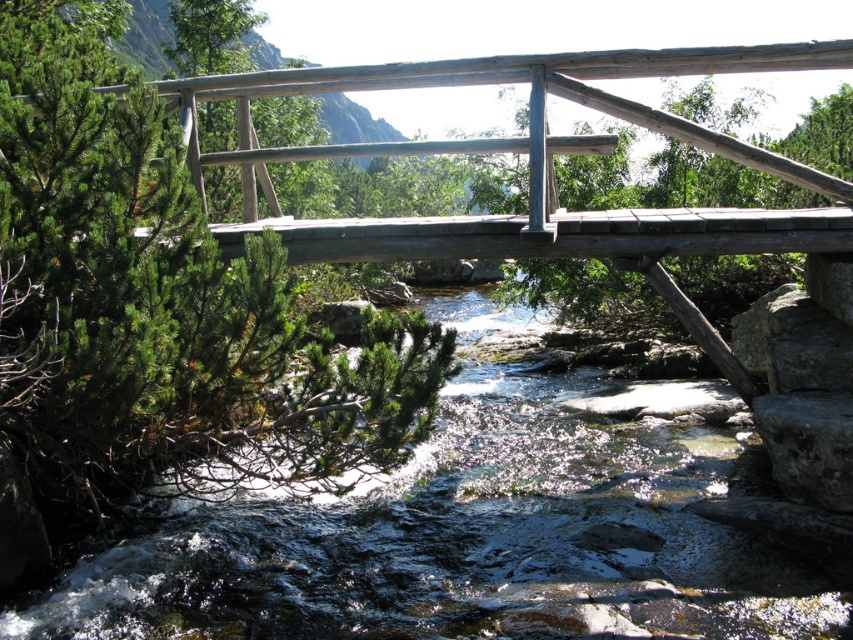
Question: From the image, what is the correct spatial relationship of clear water at center in relation to natural wood bridge at center?

Choices:
 (A) below
 (B) above

Answer: (A)

Question: Which point appears closest to the camera in this image?

Choices:
 (A) (727, 449)
 (B) (825, 193)

Answer: (B)

Question: Does clear water at center have a smaller size compared to natural wood bridge at center?

Choices:
 (A) yes
 (B) no

Answer: (B)

Question: Which of the following is the farthest from the observer?

Choices:
 (A) clear water at center
 (B) natural wood bridge at center

Answer: (B)

Question: Can you confirm if clear water at center is positioned below natural wood bridge at center?

Choices:
 (A) yes
 (B) no

Answer: (A)

Question: Which object is closer to the camera taking this photo?

Choices:
 (A) natural wood bridge at center
 (B) clear water at center

Answer: (B)